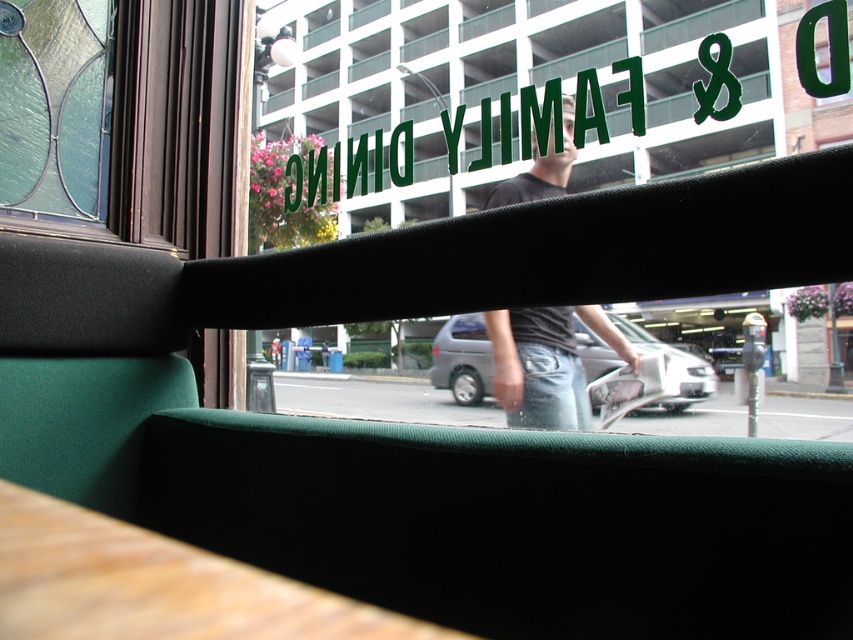
Who is more distant from viewer, (326, 17) or (283, 625)?

Point (326, 17)

Identify the location of green fabric window at center. The image size is (853, 640). 515,88.

Is point (111, 61) farther from viewer compared to point (509, 198)?

No.

Can you confirm if clear glass window at upper left is bigger than dark gray jeans at center?

→ No, clear glass window at upper left is not bigger than dark gray jeans at center.

Is point (28, 36) more distant than point (519, 406)?

No, (28, 36) is closer to viewer.

Where is `clear glass window at upper left`? This screenshot has width=853, height=640. clear glass window at upper left is located at coordinates (55, 108).

Where is `wooden table at lower left`? wooden table at lower left is located at coordinates (155, 584).

Which is more to the right, wooden table at lower left or clear glass window at upper left?

From the viewer's perspective, wooden table at lower left appears more on the right side.

Is point (157, 595) positioned in front of point (49, 115)?

Yes, point (157, 595) is closer to viewer.

You are a GUI agent. You are given a task and a screenshot of the screen. Output one action in this format:
    pyautogui.click(x=<x>, y=<y>)
    Task: Click on the wooden table at lower left
    
    Given the screenshot: What is the action you would take?
    pyautogui.click(x=155, y=584)